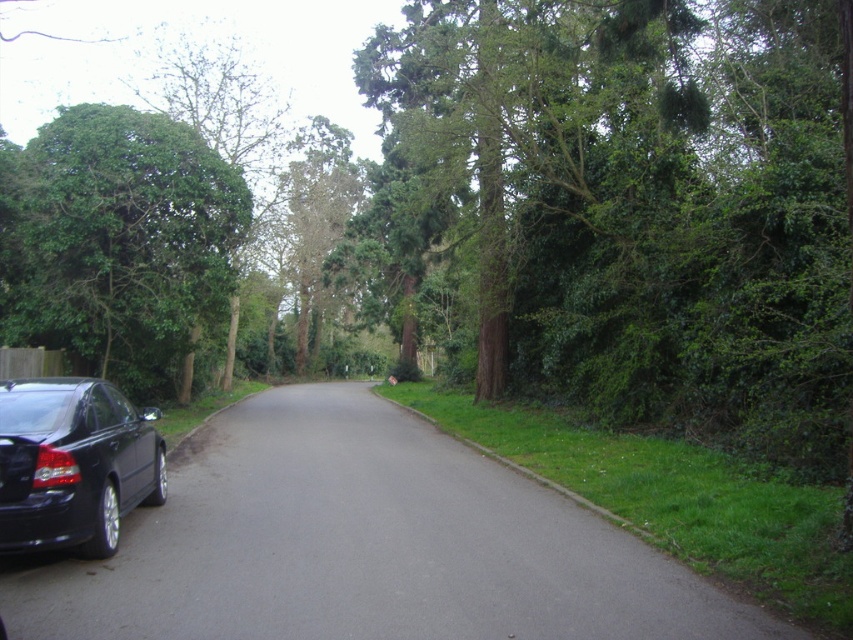
Does point (195, 337) come behind point (86, 515)?

Yes, it is behind point (86, 515).

Is green leafy tree at left bigger than glossy black car at lower left?

Correct, green leafy tree at left is larger in size than glossy black car at lower left.

Is point (61, 179) more distant than point (10, 417)?

Yes, point (61, 179) is farther from viewer.

Locate an element on the screen. The width and height of the screenshot is (853, 640). green leafy tree at left is located at coordinates (119, 241).

Does black asphalt driveway at lower left appear over green leafy tree at left?

No, black asphalt driveway at lower left is not above green leafy tree at left.

Does black asphalt driveway at lower left have a smaller size compared to green leafy tree at left?

Correct, black asphalt driveway at lower left occupies less space than green leafy tree at left.

Which is behind, point (317, 464) or point (109, 205)?

The point (109, 205) is behind.

The width and height of the screenshot is (853, 640). What are the coordinates of `black asphalt driveway at lower left` in the screenshot? It's located at (364, 545).

Does black asphalt driveway at lower left have a lesser width compared to glossy black car at lower left?

No, black asphalt driveway at lower left is not thinner than glossy black car at lower left.

Does black asphalt driveway at lower left appear on the right side of glossy black car at lower left?

Indeed, black asphalt driveway at lower left is positioned on the right side of glossy black car at lower left.

Between point (334, 576) and point (20, 408), which one is positioned behind?

Positioned behind is point (20, 408).

Where is `black asphalt driveway at lower left`? This screenshot has height=640, width=853. black asphalt driveway at lower left is located at coordinates (364, 545).